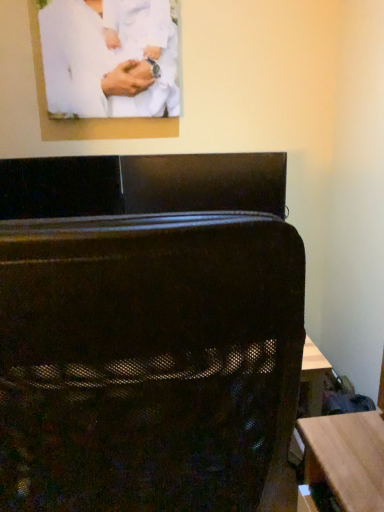
Measure the distance between point (x=144, y=11) and camera.

Point (x=144, y=11) is 5.18 feet from camera.

At what (x,y) coordinates should I click in order to perform the action: click on white matte clothing at upper center. Please return your answer as a coordinate pair (x, y). Looking at the image, I should click on (109, 57).

This screenshot has width=384, height=512. What do you see at coordinates (109, 57) in the screenshot?
I see `white matte clothing at upper center` at bounding box center [109, 57].

Image resolution: width=384 pixels, height=512 pixels. Describe the element at coordinates (148, 334) in the screenshot. I see `black mesh suitcase at center` at that location.

Measure the distance between point (153, 316) and camera.

Point (153, 316) is 46.20 centimeters away from camera.

You are a GUI agent. You are given a task and a screenshot of the screen. Output one action in this format:
    pyautogui.click(x=<x>, y=<y>)
    Task: Click on the black mesh suitcase at center
    
    Given the screenshot: What is the action you would take?
    pyautogui.click(x=148, y=334)

Find the location of `white matte clothing at upper center`. white matte clothing at upper center is located at coordinates (109, 57).

Can you confirm if black mesh suitcase at center is positioned to the left of white matte clothing at upper center?

No, black mesh suitcase at center is not to the left of white matte clothing at upper center.

Who is more distant, black mesh suitcase at center or white matte clothing at upper center?

white matte clothing at upper center.

Which is further, (295, 298) or (170, 24)?

The point (170, 24) is more distant.

From the image's perspective, is black mesh suitcase at center located above or below white matte clothing at upper center?

black mesh suitcase at center is situated lower than white matte clothing at upper center in the image.

From a real-world perspective, is black mesh suitcase at center located higher than white matte clothing at upper center?

Incorrect, from a real-world perspective, black mesh suitcase at center is lower than white matte clothing at upper center.

Is black mesh suitcase at center thinner than white matte clothing at upper center?

Incorrect, the width of black mesh suitcase at center is not less than that of white matte clothing at upper center.

Is black mesh suitcase at center shorter than white matte clothing at upper center?

No.

Who is smaller, black mesh suitcase at center or white matte clothing at upper center?

With smaller size is white matte clothing at upper center.

Is black mesh suitcase at center spatially inside white matte clothing at upper center, or outside of it?

black mesh suitcase at center lies outside white matte clothing at upper center.

Is black mesh suitcase at center positioned far away from white matte clothing at upper center?

No, black mesh suitcase at center is in close proximity to white matte clothing at upper center.

Is black mesh suitcase at center oriented away from white matte clothing at upper center?

No, black mesh suitcase at center is not facing the opposite direction of white matte clothing at upper center.

How many degrees apart are the facing directions of black mesh suitcase at center and white matte clothing at upper center?

black mesh suitcase at center and white matte clothing at upper center are facing 178 degrees away from each other.

The height and width of the screenshot is (512, 384). I want to click on person lying above the black mesh suitcase at center (from the image's perspective), so click(x=109, y=57).

Is white matte clothing at upper center at the left side of black mesh suitcase at center?

Correct, you'll find white matte clothing at upper center to the left of black mesh suitcase at center.

Does white matte clothing at upper center lie in front of black mesh suitcase at center?

That is False.

Is point (166, 34) positioned behind point (144, 432)?

Yes, point (166, 34) is behind point (144, 432).

In the scene shown: From the image's perspective, is white matte clothing at upper center beneath black mesh suitcase at center?

No, from the image's perspective, white matte clothing at upper center is not beneath black mesh suitcase at center.

From a real-world perspective, who is located lower, white matte clothing at upper center or black mesh suitcase at center?

black mesh suitcase at center.

Considering the sizes of objects white matte clothing at upper center and black mesh suitcase at center in the image provided, who is thinner, white matte clothing at upper center or black mesh suitcase at center?

white matte clothing at upper center is thinner.

Does white matte clothing at upper center have a lesser height compared to black mesh suitcase at center?

Indeed, white matte clothing at upper center has a lesser height compared to black mesh suitcase at center.

Who is smaller, white matte clothing at upper center or black mesh suitcase at center?

Smaller between the two is white matte clothing at upper center.

Is white matte clothing at upper center completely or partially outside of black mesh suitcase at center?

Absolutely, white matte clothing at upper center is external to black mesh suitcase at center.

Is white matte clothing at upper center in contact with black mesh suitcase at center?

No, white matte clothing at upper center is not next to black mesh suitcase at center.

Is white matte clothing at upper center positioned with its back to black mesh suitcase at center?

white matte clothing at upper center does not have its back to black mesh suitcase at center.

Can you tell me how much white matte clothing at upper center and black mesh suitcase at center differ in facing direction?

178 degrees.

You are a GUI agent. You are given a task and a screenshot of the screen. Output one action in this format:
    pyautogui.click(x=<x>, y=<y>)
    Task: Click on the person behind the black mesh suitcase at center
    The image size is (384, 512).
    Given the screenshot: What is the action you would take?
    pyautogui.click(x=109, y=57)

You are a GUI agent. You are given a task and a screenshot of the screen. Output one action in this format:
    pyautogui.click(x=<x>, y=<y>)
    Task: Click on the furniture below the white matte clothing at upper center (from a real-world perspective)
    This screenshot has width=384, height=512.
    Given the screenshot: What is the action you would take?
    pyautogui.click(x=148, y=334)

Locate an element on the screen. The height and width of the screenshot is (512, 384). person that appears above the black mesh suitcase at center (from a real-world perspective) is located at coordinates (109, 57).